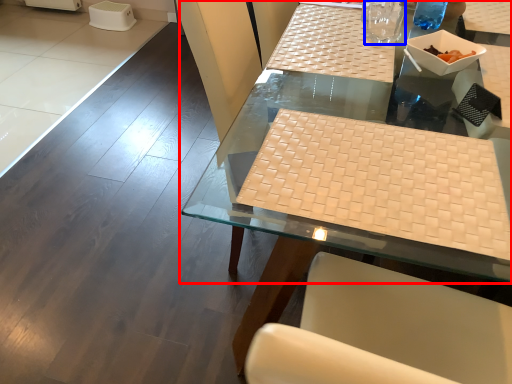
Question: Among these objects, which one is nearest to the camera, table (highlighted by a red box) or clear (highlighted by a blue box)?

Choices:
 (A) table
 (B) clear

Answer: (A)